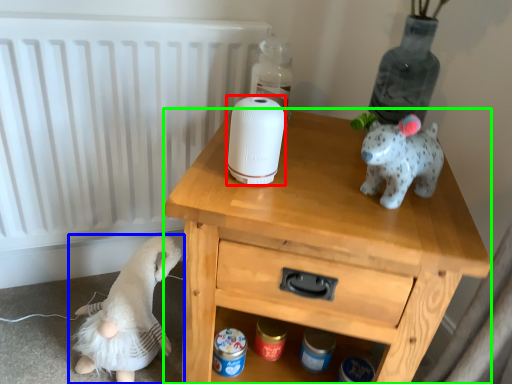
Question: Considering the real-world distances, which object is farthest from toilet paper (highlighted by a red box)? toy (highlighted by a blue box) or nightstand (highlighted by a green box)?

Choices:
 (A) toy
 (B) nightstand

Answer: (A)